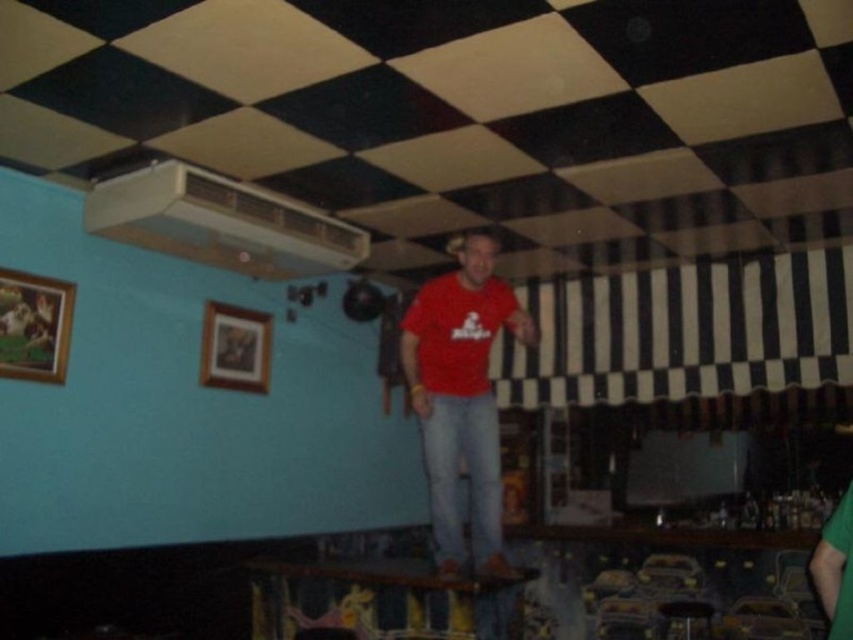
Question: Which of the following is the farthest from the observer?

Choices:
 (A) (688, 634)
 (B) (838, 612)
 (C) (469, 244)

Answer: (A)

Question: Estimate the real-world distances between objects in this image. Which object is farther from the wooden stool at lower right?

Choices:
 (A) green fabric shirt at lower right
 (B) red matte shirt at center

Answer: (A)

Question: Does red matte shirt at center have a larger size compared to wooden stool at lower right?

Choices:
 (A) yes
 (B) no

Answer: (A)

Question: Can you confirm if red matte shirt at center is smaller than wooden stool at lower right?

Choices:
 (A) no
 (B) yes

Answer: (A)

Question: Among these objects, which one is nearest to the camera?

Choices:
 (A) red matte shirt at center
 (B) green fabric shirt at lower right
 (C) wooden stool at lower right

Answer: (B)

Question: Does red matte shirt at center appear on the left side of green fabric shirt at lower right?

Choices:
 (A) yes
 (B) no

Answer: (A)